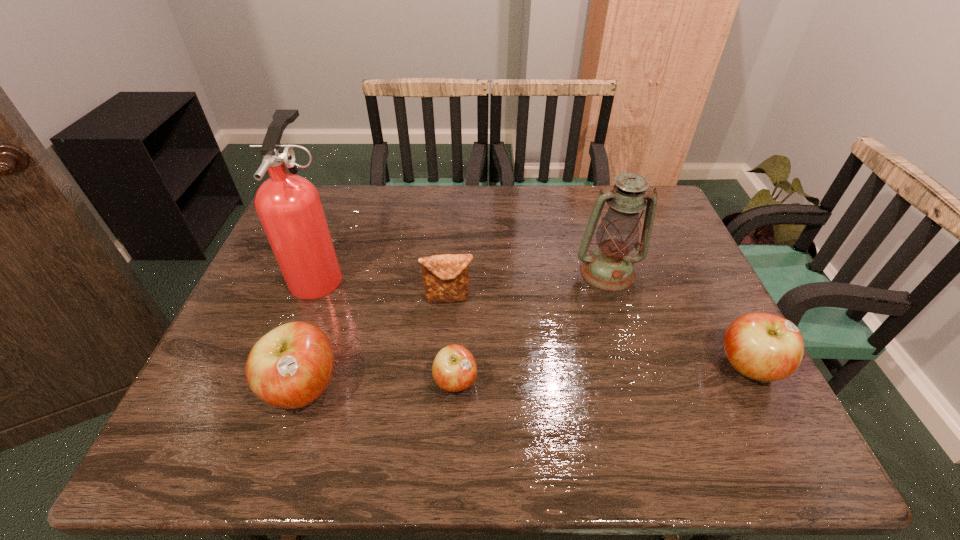
To achieve uniform spacing by inserting another apple among them, please point to a free space for this new apple. Please provide its 2D coordinates. Your answer should be formatted as a tuple, i.e. [(x, y)], where the tuple contains the x and y coordinates of a point satisfying the conditions above.

[(604, 375)]